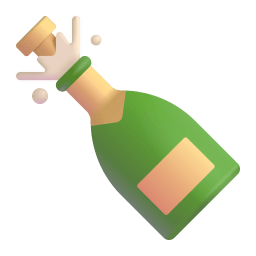
Find the location of a particular element. The image size is (256, 256). green bottle is located at coordinates (182, 123).